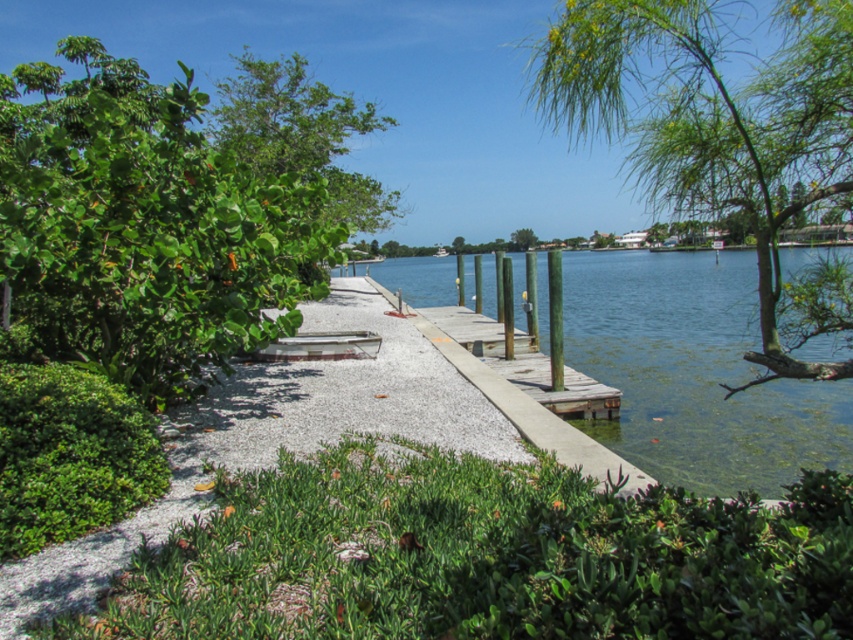
Question: Does wooden dock at center appear under green leafy tree at center?

Choices:
 (A) yes
 (B) no

Answer: (A)

Question: Which point is closer to the camera?

Choices:
 (A) green leafy tree at upper left
 (B) green leafy tree at left
 (C) clear water at dock center
 (D) green leafy tree at upper right

Answer: (D)

Question: Which of these objects is positioned closest to the green leafy tree at left?

Choices:
 (A) green leafy tree at center
 (B) green leafy tree at upper left
 (C) wooden dock at center
 (D) clear water at dock center

Answer: (B)

Question: Considering the relative positions of green leafy tree at upper left and wooden dock at center in the image provided, where is green leafy tree at upper left located with respect to wooden dock at center?

Choices:
 (A) right
 (B) left

Answer: (B)

Question: Observing the image, what is the correct spatial positioning of green leafy tree at upper right in reference to clear water at dock center?

Choices:
 (A) below
 (B) above

Answer: (B)

Question: Which object is positioned closest to the green leafy tree at upper right?

Choices:
 (A) wooden dock at center
 (B) green leafy tree at upper left
 (C) green leafy tree at left
 (D) clear water at dock center

Answer: (D)